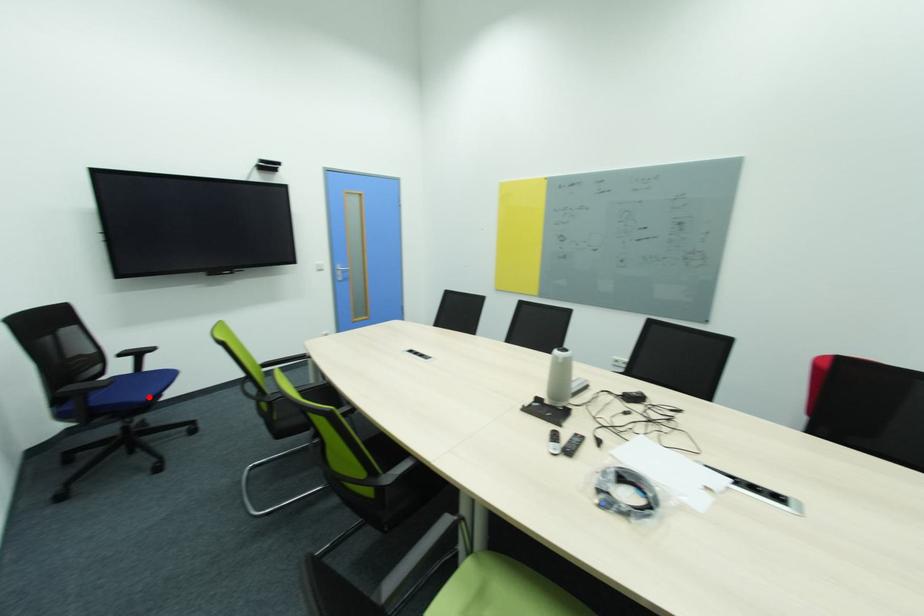
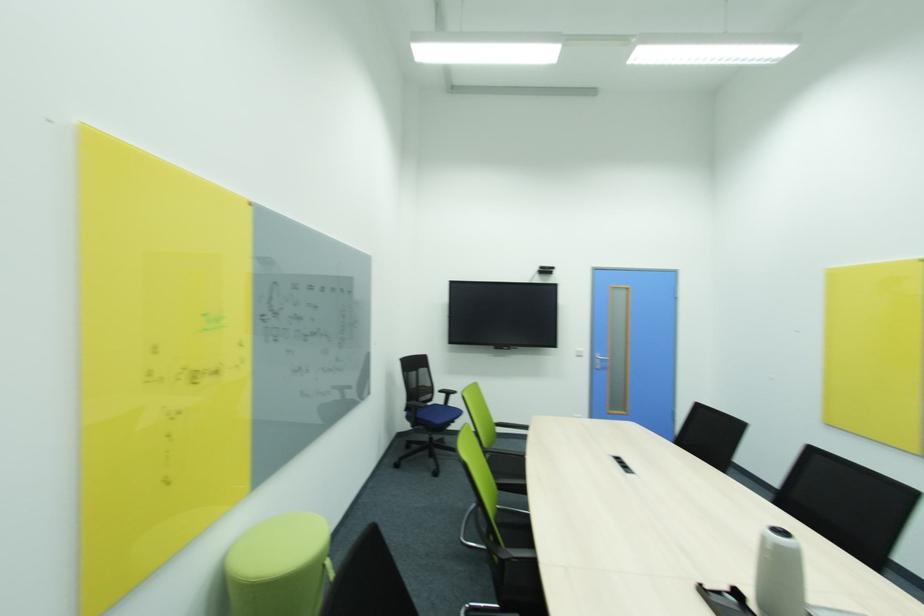
Question: I am providing you with two images of the same scene from different viewpoints. Image1 has a red point marked. In image2, the corresponding 3D location appears at what relative position? Reply with the corresponding letter.

Choices:
 (A) Closer
 (B) Farther

Answer: (B)